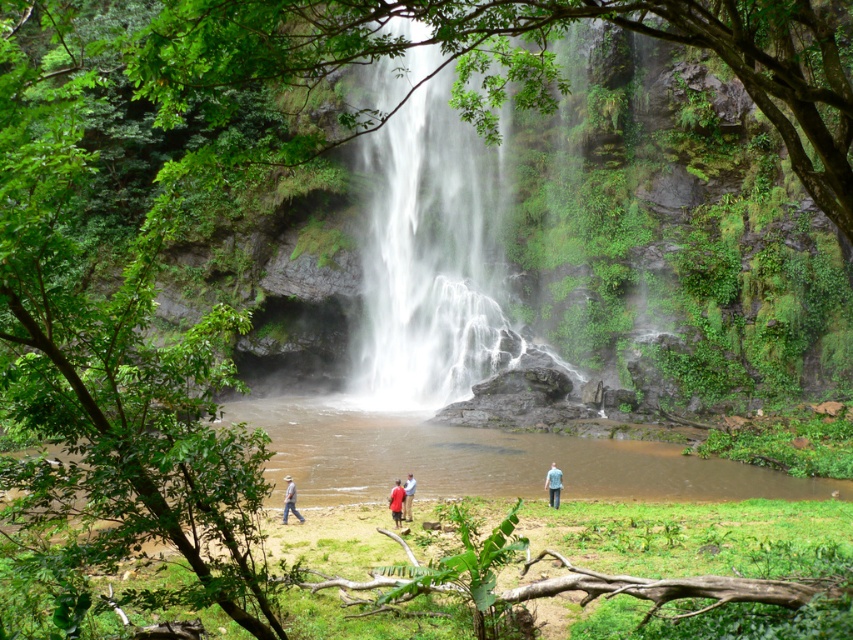
Based on the photo, you are standing at the camera position and want to reach the point marked as point (x=363, y=365). If your walking speed is 1.5 meters per second, how many seconds will it take you to reach that point?

The distance of point (x=363, y=365) from camera is 40.91 meters. At a walking speed of 1.5 meters per second, it will take approximately 27.27 seconds to reach the point.

You are standing in the grassy clearing near the waterfall and see both the brown leather hat at lower left and the matte red shirt at center. Which object is closer to the ground?

The brown leather hat at lower left is shorter than the matte red shirt at center, so it is closer to the ground.